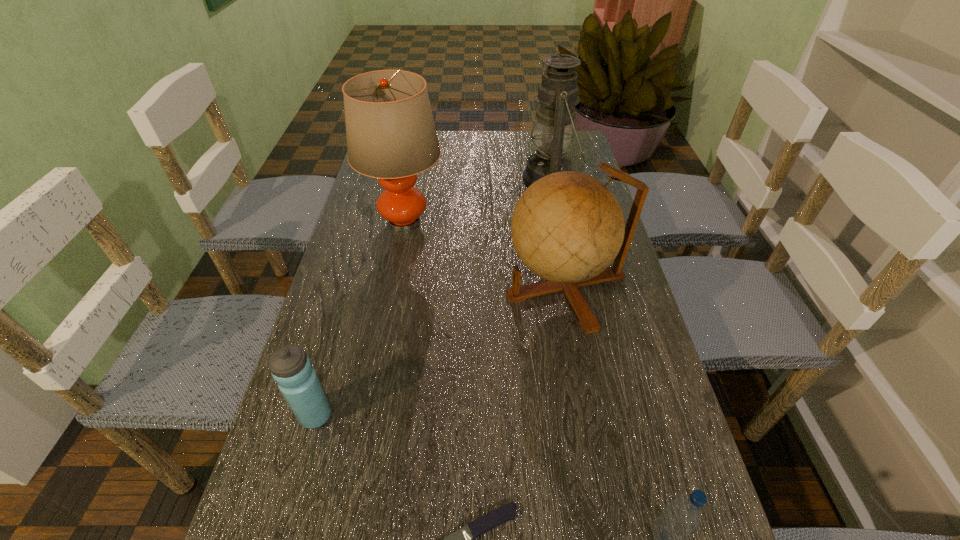
At what (x,y) coordinates should I click in order to perform the action: click on vacant space located on the right of the farther water bottle. Please return your answer as a coordinate pair (x, y). Looking at the image, I should click on (445, 415).

What are the coordinates of `object present at the far edge` in the screenshot? It's located at 558,92.

Find the location of a particular element. The width and height of the screenshot is (960, 540). lamp positioned at the left edge is located at coordinates (391, 135).

The image size is (960, 540). What are the coordinates of `water bottle present at the left edge` in the screenshot? It's located at (291, 368).

Locate an element on the screen. This screenshot has height=540, width=960. oil lamp that is positioned at the right edge is located at coordinates (558, 92).

Locate an element on the screen. The height and width of the screenshot is (540, 960). globe present at the right edge is located at coordinates (567, 227).

Locate an element on the screen. The height and width of the screenshot is (540, 960). object at the far right corner is located at coordinates (558, 92).

This screenshot has height=540, width=960. In order to click on vacant space at the left edge of the desktop in this screenshot , I will do `click(368, 246)`.

Where is `free space at the right edge of the desktop`? Image resolution: width=960 pixels, height=540 pixels. free space at the right edge of the desktop is located at coordinates tap(605, 429).

Where is `free space between the lamp and the taller water bottle`? The width and height of the screenshot is (960, 540). free space between the lamp and the taller water bottle is located at coordinates (360, 319).